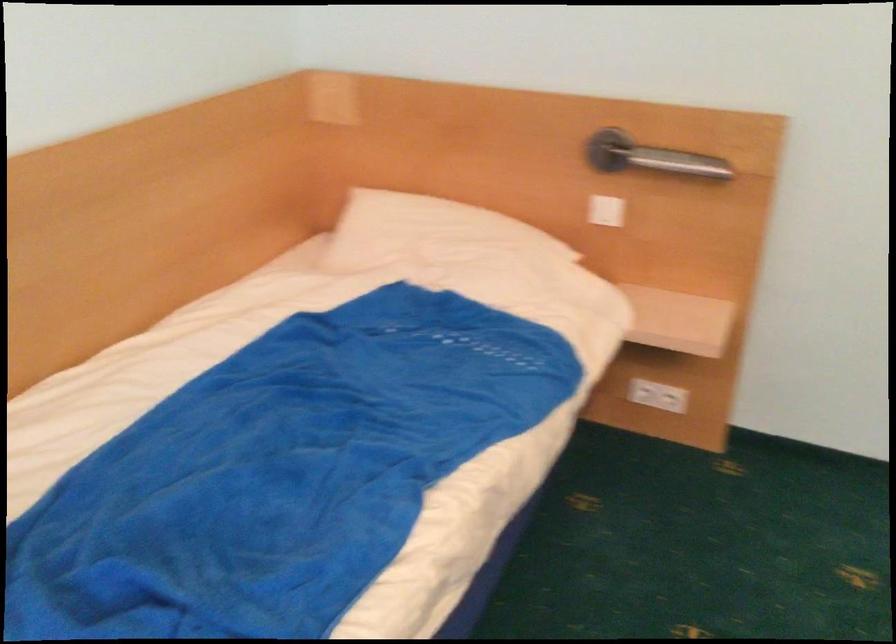
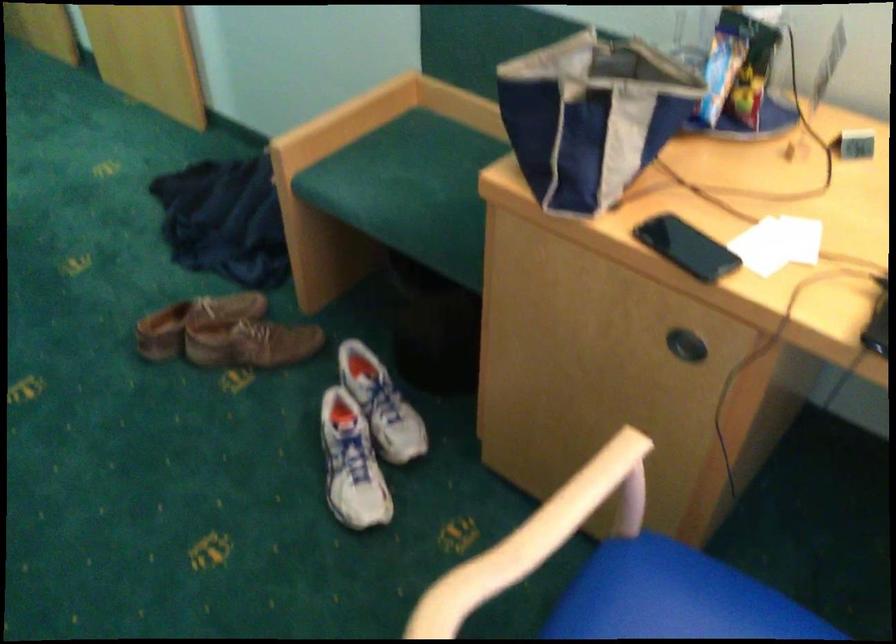
The images are taken continuously from a first-person perspective. In which direction is your viewpoint rotating?

The rotation direction of the camera is right-down.